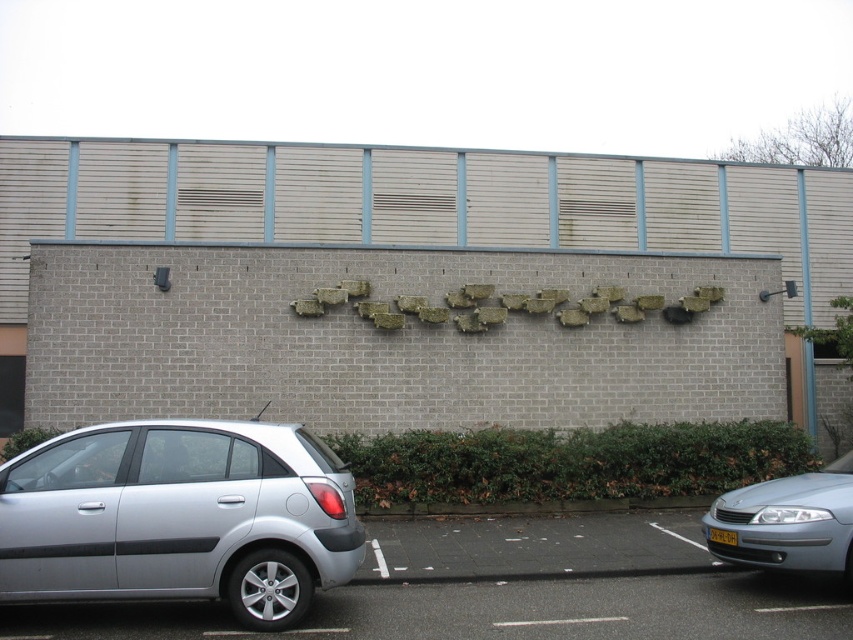
The height and width of the screenshot is (640, 853). Identify the location of silver metallic hatchback at lower left. (178, 516).

Between silver metallic hatchback at lower left and silver metallic car at lower left, which one has more height?

With more height is silver metallic hatchback at lower left.

You are a GUI agent. You are given a task and a screenshot of the screen. Output one action in this format:
    pyautogui.click(x=<x>, y=<y>)
    Task: Click on the silver metallic hatchback at lower left
    This screenshot has width=853, height=640.
    Given the screenshot: What is the action you would take?
    pyautogui.click(x=178, y=516)

At what (x,y) coordinates should I click in order to perform the action: click on silver metallic hatchback at lower left. Please return your answer as a coordinate pair (x, y). This screenshot has width=853, height=640. Looking at the image, I should click on (178, 516).

Can you confirm if silver metallic car at lower left is positioned above matte silver sedan at lower right?

No, silver metallic car at lower left is not above matte silver sedan at lower right.

Consider the image. Who is higher up, silver metallic car at lower left or matte silver sedan at lower right?

matte silver sedan at lower right is higher up.

The image size is (853, 640). What do you see at coordinates (567, 584) in the screenshot?
I see `silver metallic car at lower left` at bounding box center [567, 584].

This screenshot has width=853, height=640. In order to click on silver metallic car at lower left in this screenshot , I will do `click(567, 584)`.

How much distance is there between silver metallic hatchback at lower left and matte silver sedan at lower right?

silver metallic hatchback at lower left is 12.93 feet away from matte silver sedan at lower right.

Does silver metallic hatchback at lower left have a larger size compared to matte silver sedan at lower right?

Indeed, silver metallic hatchback at lower left has a larger size compared to matte silver sedan at lower right.

This screenshot has height=640, width=853. What do you see at coordinates (178, 516) in the screenshot?
I see `silver metallic hatchback at lower left` at bounding box center [178, 516].

The height and width of the screenshot is (640, 853). Find the location of `silver metallic hatchback at lower left`. silver metallic hatchback at lower left is located at coordinates [x=178, y=516].